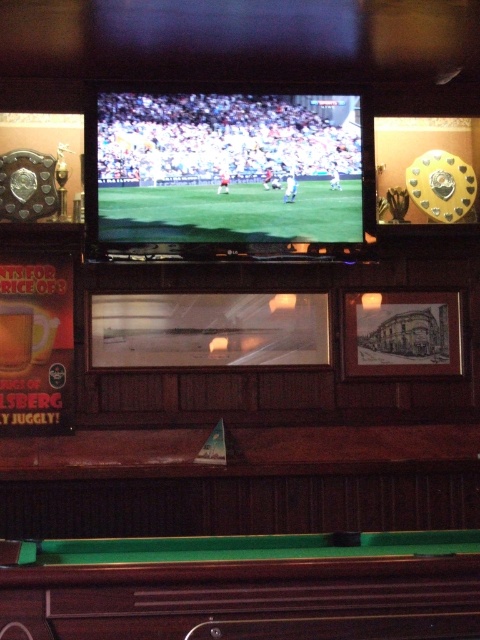
You are a customer in this pub and want to place your drink on a surface. Which object, the green felt pool table at bottom or the matte green screen at center, is a suitable surface for placing your drink?

The green felt pool table at bottom is a suitable surface for placing your drink because it is positioned under the matte green screen at center, making it accessible and flat for placing items.

You are a customer in a pub and want to place your drink on the nearest surface. You see the green felt pool table at bottom and the matte green screen at center. Which surface is closer to you?

The green felt pool table at bottom is positioned on the right side of matte green screen at center, so the pool table is closer to you.